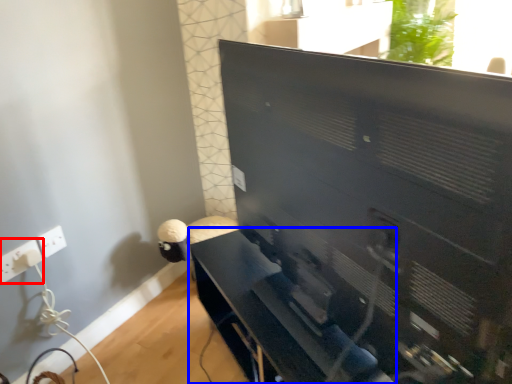
Question: Which of the following is the closest to the observer, electric outlet (highlighted by a red box) or furniture (highlighted by a blue box)?

Choices:
 (A) electric outlet
 (B) furniture

Answer: (B)